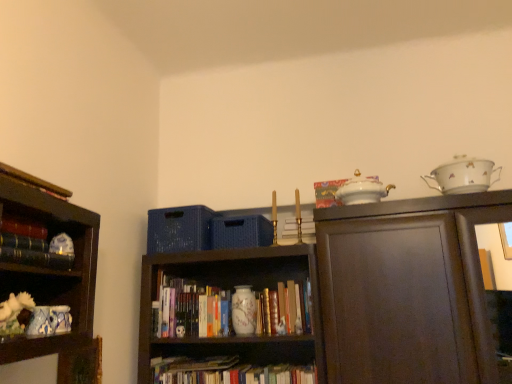
Question: From a real-world perspective, is white porcelain teapot at upper center located beneath white porcelain tea set at upper right?

Choices:
 (A) no
 (B) yes

Answer: (B)

Question: Can you confirm if white porcelain teapot at upper center is shorter than white porcelain tea set at upper right?

Choices:
 (A) yes
 (B) no

Answer: (A)

Question: Considering the relative sizes of white porcelain teapot at upper center and white porcelain tea set at upper right in the image provided, is white porcelain teapot at upper center thinner than white porcelain tea set at upper right?

Choices:
 (A) yes
 (B) no

Answer: (B)

Question: Is white porcelain teapot at upper center placed right next to white porcelain tea set at upper right?

Choices:
 (A) yes
 (B) no

Answer: (B)

Question: Can you confirm if white porcelain teapot at upper center is bigger than white porcelain tea set at upper right?

Choices:
 (A) no
 (B) yes

Answer: (A)

Question: Is the depth of white porcelain teapot at upper center greater than that of white porcelain tea set at upper right?

Choices:
 (A) yes
 (B) no

Answer: (A)

Question: Is hardcover book at center, the first book from the right, at the back of hardcover books at center, the 3th book in the front-to-back sequence?

Choices:
 (A) yes
 (B) no

Answer: (B)

Question: Is hardcover books at center, the 1th book ordered from the bottom, to the right of hardcover book at center, which ranks as the 3th book in left-to-right order, from the viewer's perspective?

Choices:
 (A) no
 (B) yes

Answer: (A)

Question: Considering the relative sizes of hardcover books at center, the second book in the left-to-right sequence, and hardcover book at center, which appears as the second book when viewed from the back, in the image provided, is hardcover books at center, the second book in the left-to-right sequence, thinner than hardcover book at center, which appears as the second book when viewed from the back,?

Choices:
 (A) yes
 (B) no

Answer: (B)

Question: Is hardcover book at center, which appears as the second book when viewed from the back, inside hardcover books at center, the 3th book in the front-to-back sequence?

Choices:
 (A) yes
 (B) no

Answer: (B)

Question: Is hardcover books at center, arranged as the 2th book when viewed from the right, closer to camera compared to hardcover book at center, the first book from the right?

Choices:
 (A) yes
 (B) no

Answer: (B)

Question: Would you say hardcover books at center, arranged as the 2th book when viewed from the right, is outside hardcover book at center, which is the 2th book in bottom-to-top order?

Choices:
 (A) no
 (B) yes

Answer: (B)

Question: Can you confirm if hardcover book at center, placed as the 2th book when sorted from front to back, is taller than hardcover books at center, the second book in the left-to-right sequence?

Choices:
 (A) yes
 (B) no

Answer: (B)